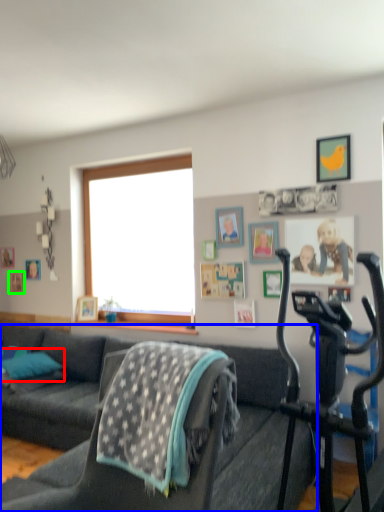
Question: Considering the real-world distances, which object is farthest from pillow (highlighted by a red box)? studio couch (highlighted by a blue box) or picture frame (highlighted by a green box)?

Choices:
 (A) studio couch
 (B) picture frame

Answer: (B)